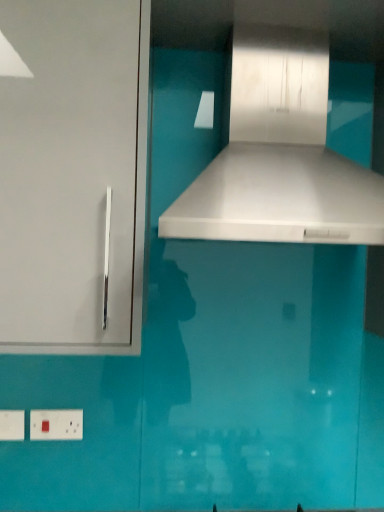
Question: Is white glossy vent at center further to camera compared to white glossy cabinet handle at left?

Choices:
 (A) no
 (B) yes

Answer: (A)

Question: From the image's perspective, is white glossy vent at center above white glossy cabinet handle at left?

Choices:
 (A) no
 (B) yes

Answer: (B)

Question: Is white glossy vent at center placed right next to white glossy cabinet handle at left?

Choices:
 (A) no
 (B) yes

Answer: (A)

Question: Can you confirm if white glossy vent at center is smaller than white glossy cabinet handle at left?

Choices:
 (A) yes
 (B) no

Answer: (B)

Question: Considering the relative sizes of white glossy vent at center and white glossy cabinet handle at left in the image provided, is white glossy vent at center taller than white glossy cabinet handle at left?

Choices:
 (A) yes
 (B) no

Answer: (B)

Question: Is white plastic electric outlet at lower left, arranged as the second electric outlet when viewed from the right, wider or thinner than white glossy cabinet handle at left?

Choices:
 (A) wide
 (B) thin

Answer: (B)

Question: Based on their positions, is white plastic electric outlet at lower left, arranged as the second electric outlet when viewed from the right, located to the left or right of white glossy cabinet handle at left?

Choices:
 (A) right
 (B) left

Answer: (B)

Question: Considering the positions of white plastic electric outlet at lower left, arranged as the second electric outlet when viewed from the right, and white glossy cabinet handle at left in the image, is white plastic electric outlet at lower left, arranged as the second electric outlet when viewed from the right, bigger or smaller than white glossy cabinet handle at left?

Choices:
 (A) small
 (B) big

Answer: (A)

Question: Choose the correct answer: Is white plastic electric outlet at lower left, arranged as the second electric outlet when viewed from the right, inside white glossy cabinet handle at left or outside it?

Choices:
 (A) outside
 (B) inside

Answer: (A)

Question: Is point (31, 415) positioned closer to the camera than point (283, 111)?

Choices:
 (A) closer
 (B) farther

Answer: (B)

Question: Would you say white plastic electric outlet at lower left, the second electric outlet in the left-to-right sequence, is to the left or to the right of white glossy vent at center in the picture?

Choices:
 (A) right
 (B) left

Answer: (B)

Question: From a real-world perspective, is white plastic electric outlet at lower left, the first electric outlet from the right, above or below white glossy vent at center?

Choices:
 (A) above
 (B) below

Answer: (B)

Question: Is white plastic electric outlet at lower left, the second electric outlet in the left-to-right sequence, in front of or behind white glossy vent at center in the image?

Choices:
 (A) front
 (B) behind

Answer: (B)

Question: From the image's perspective, is white plastic electric outlet at lower left, arranged as the second electric outlet when viewed from the right, above or below white glossy vent at center?

Choices:
 (A) below
 (B) above

Answer: (A)

Question: In the image, is white plastic electric outlet at lower left, the first electric outlet viewed from the left, on the left side or the right side of white glossy vent at center?

Choices:
 (A) left
 (B) right

Answer: (A)